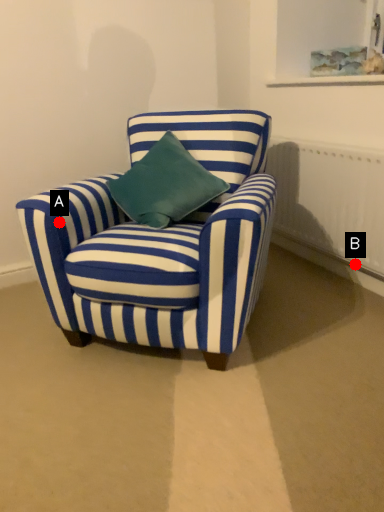
Question: Two points are circled on the image, labeled by A and B beside each circle. Which point is closer to the camera taking this photo?

Choices:
 (A) A is closer
 (B) B is closer

Answer: (A)